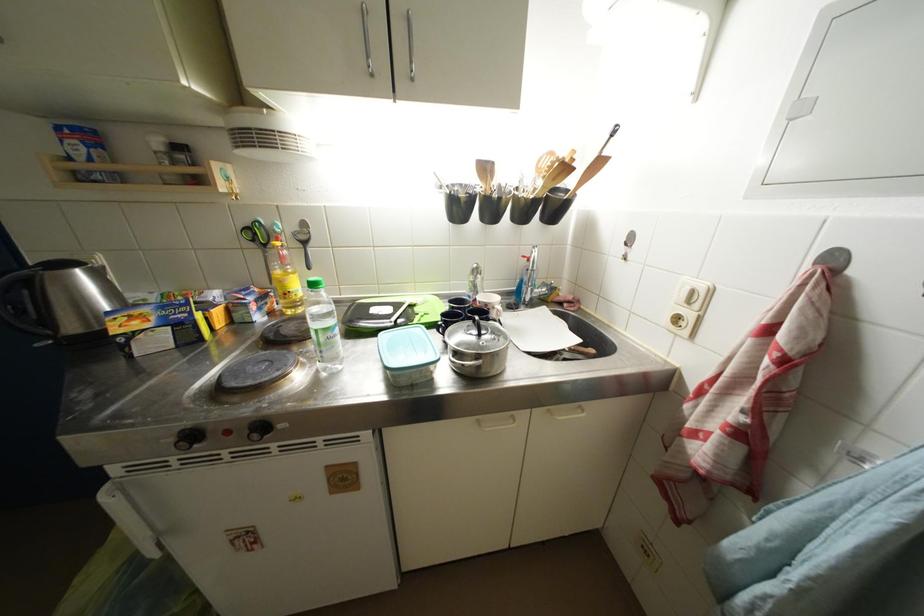
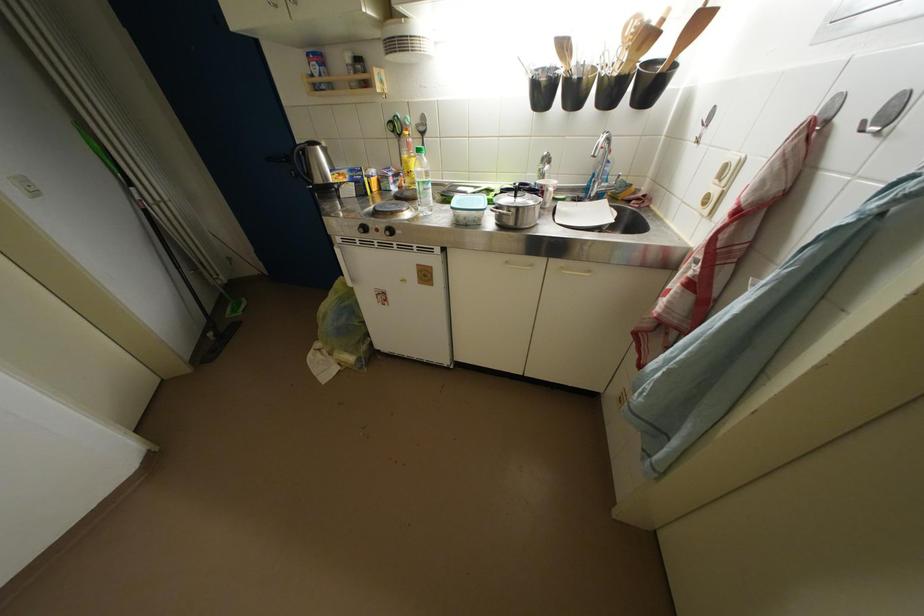
Locate, in the second image, the point that corresponds to (x=546, y=187) in the first image.

(631, 60)